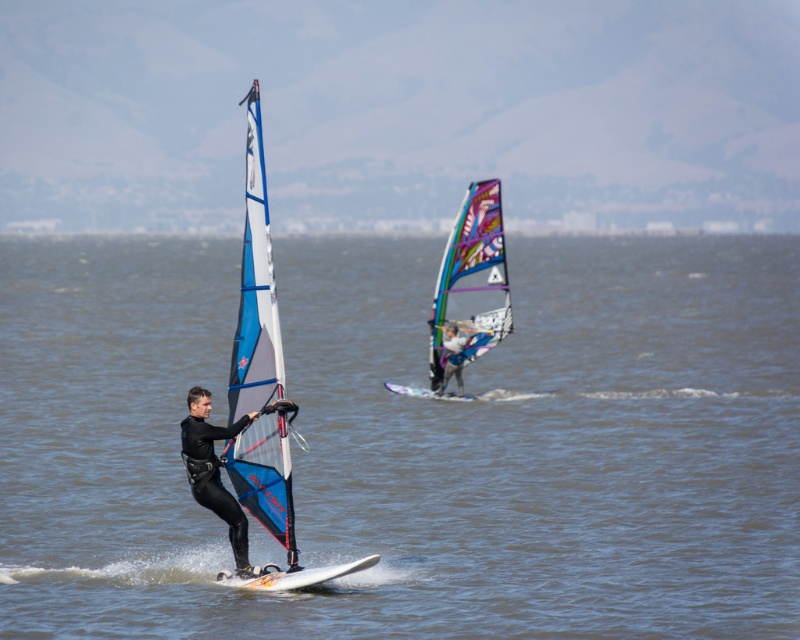
You are a photographer trying to capture both the multicolored mesh sail at center and the matte blue sail at center in a single frame. Given that your camera has a 15 inch field of view, can you fit both sails into the shot?

The multicolored mesh sail at center and the matte blue sail at center are 20.66 inches apart, which exceeds the camera field of view of 15 inches. Therefore, you cannot fit both sails into the shot.

You are a photographer trying to capture the windsurfer in the center. You notice the black matte wetsuit at center and the matte blue sail at center. Which object should you focus on first if you want to photograph the person closest to you?

The black matte wetsuit at center is to the left of the matte blue sail at center, but since both are part of the same windsurfer, you should focus on either as they are part of the same subject.